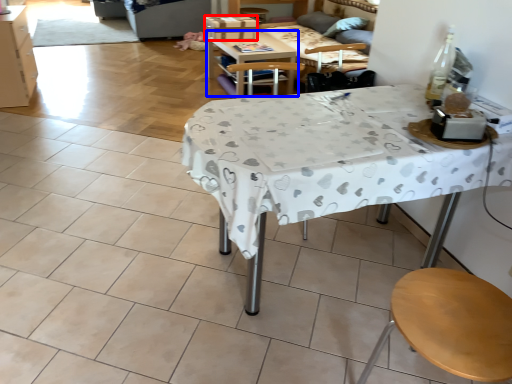
Question: Which of the following is the closest to the observer, box (highlighted by a red box) or table (highlighted by a blue box)?

Choices:
 (A) box
 (B) table

Answer: (B)